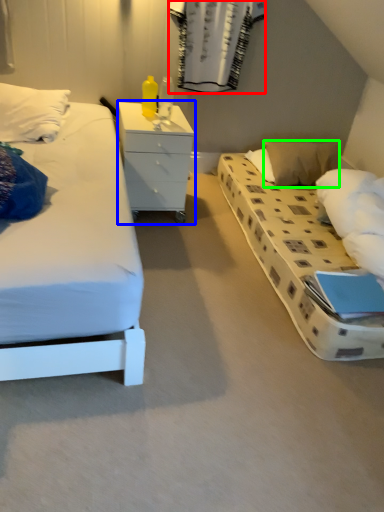
Question: Which is nearer to the curtain (highlighted by a red box)? chest of drawers (highlighted by a blue box) or pillow (highlighted by a green box).

Choices:
 (A) chest of drawers
 (B) pillow

Answer: (B)